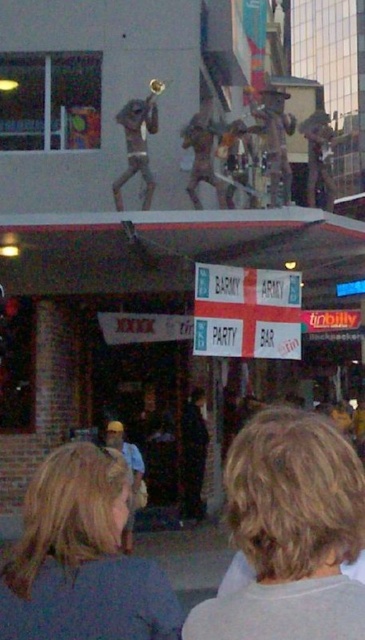
Question: Among these points, which one is nearest to the camera?

Choices:
 (A) (121, 120)
 (B) (82, 500)

Answer: (B)

Question: Is blonde hair at center to the left of blonde hair at lower left from the viewer's perspective?

Choices:
 (A) no
 (B) yes

Answer: (A)

Question: In this image, where is blonde hair at center located relative to bronze statue at upper center?

Choices:
 (A) above
 (B) below

Answer: (B)

Question: Which of the following is the farthest from the observer?

Choices:
 (A) blonde hair at lower left
 (B) bronze statue at upper center

Answer: (B)

Question: Among these points, which one is nearest to the camera?

Choices:
 (A) (305, 552)
 (B) (154, 188)

Answer: (A)

Question: Does blonde hair at center come behind bronze statue at upper center?

Choices:
 (A) yes
 (B) no

Answer: (B)